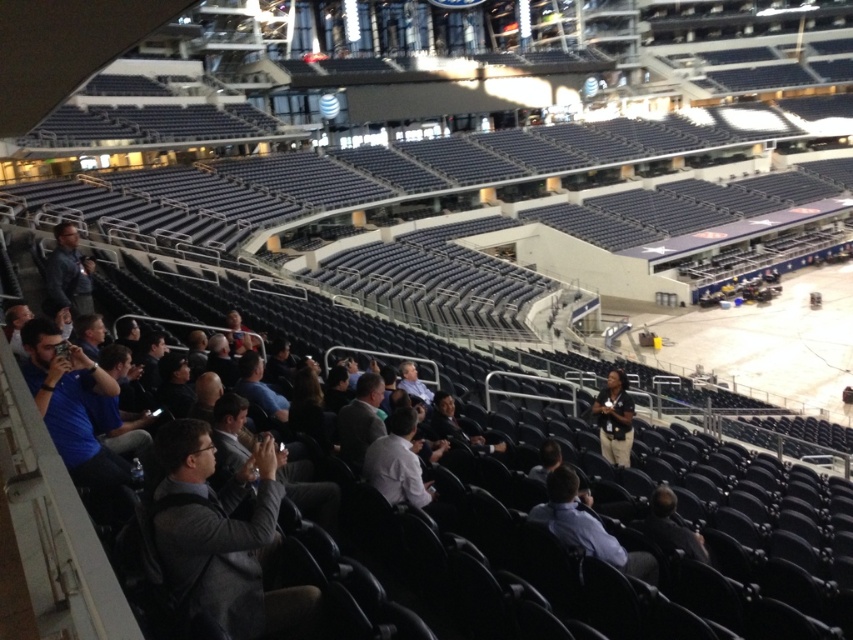
Question: Which point is closer to the camera taking this photo?

Choices:
 (A) (67, 288)
 (B) (602, 397)
 (C) (664, 497)
 (D) (560, 472)

Answer: (D)

Question: Does dark gray shirt at center appear on the right side of dark gray suit at center?

Choices:
 (A) no
 (B) yes

Answer: (B)

Question: Estimate the real-world distances between objects in this image. Which object is farther from the light blue shirt at center?

Choices:
 (A) dark gray jacket at left
 (B) dark gray shirt at center
 (C) dark gray suit at center

Answer: (A)

Question: Estimate the real-world distances between objects in this image. Which object is closer to the dark gray jacket at left?

Choices:
 (A) light blue shirt at center
 (B) dark gray suit at center
 (C) dark gray shirt at center

Answer: (A)

Question: Is dark gray jacket at left to the left of dark gray suit at center from the viewer's perspective?

Choices:
 (A) yes
 (B) no

Answer: (A)

Question: Is dark gray jacket at left closer to the viewer compared to dark gray suit at center?

Choices:
 (A) no
 (B) yes

Answer: (A)